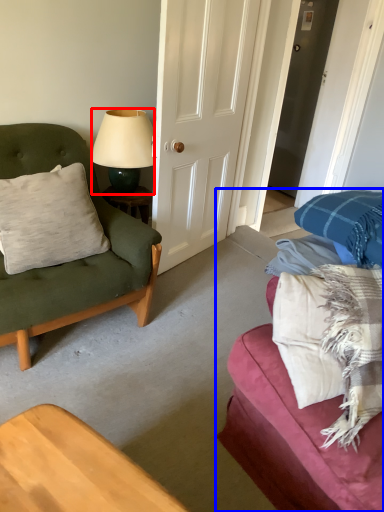
Question: Which of the following is the closest to the observer, lamp (highlighted by a red box) or studio couch (highlighted by a blue box)?

Choices:
 (A) lamp
 (B) studio couch

Answer: (B)